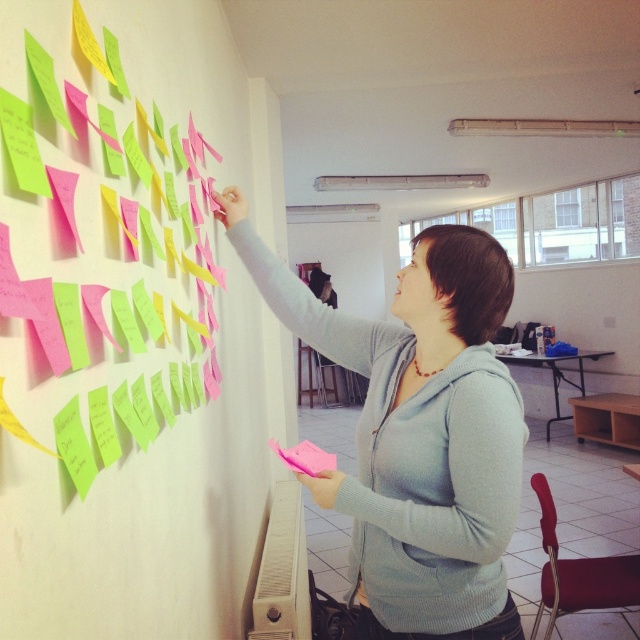
You are a person standing in the room and want to place a new pink sticky note on the wall. Where should you place it to match the existing pink paper notes at upper left?

You should place the new pink sticky note at the position of point (157, 502) to match the existing pink paper notes at upper left.